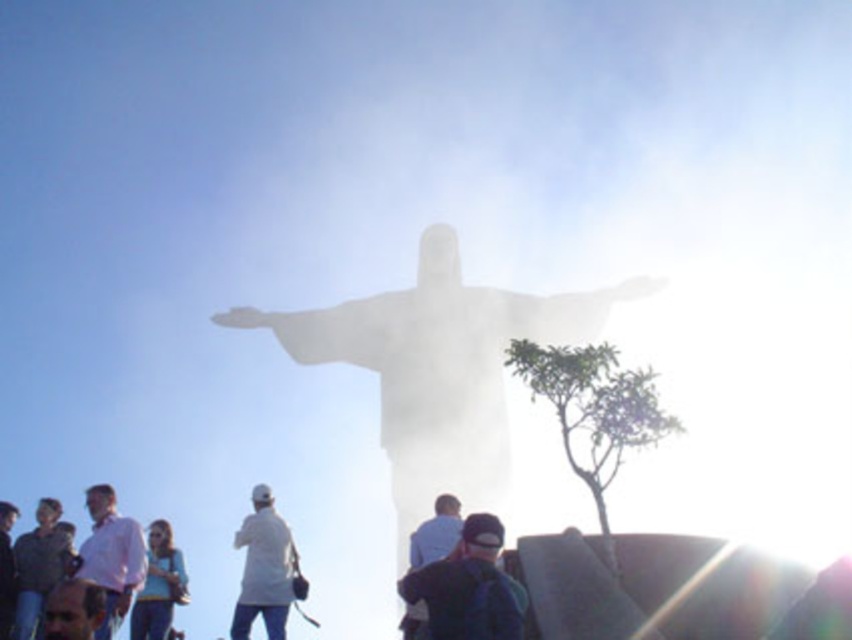
You are standing at the base of the statue and want to take a photo of the point at coordinates point (576, 321). If your camera has a maximum zoom range of 100 meters, will you be able to capture the point clearly?

The point at coordinates point (576, 321) is 122.20 meters away from the camera. Since the maximum zoom range is 100 meters, the camera cannot capture the point clearly at this distance.

You are a tourist standing at the base of the white marble statue at center. You want to take a photo of the statue with the cityscape in the background. Considering the distance between you and the statue, will you be able to capture the entire statue in your smartphone camera frame?

The white marble statue at center is 106.28 meters away from the viewer. Since smartphones have a limited zoom capability, capturing the entire statue from that distance may be challenging. It is recommended to move closer or use a camera with a higher zoom lens for a full view.

You are standing at the point marked as point (383,448) and want to take a photo of the statue of Christ the Redeemer. The statue is 38 meters tall. If your camera can capture objects up to 40 meters in height from your current position, will you be able to capture the entire statue in your photo?

The statue of Christ the Redeemer is 38 meters tall, and your camera can capture objects up to 40 meters in height. Since 38 meters is less than 40 meters, you will be able to capture the entire statue in your photo.